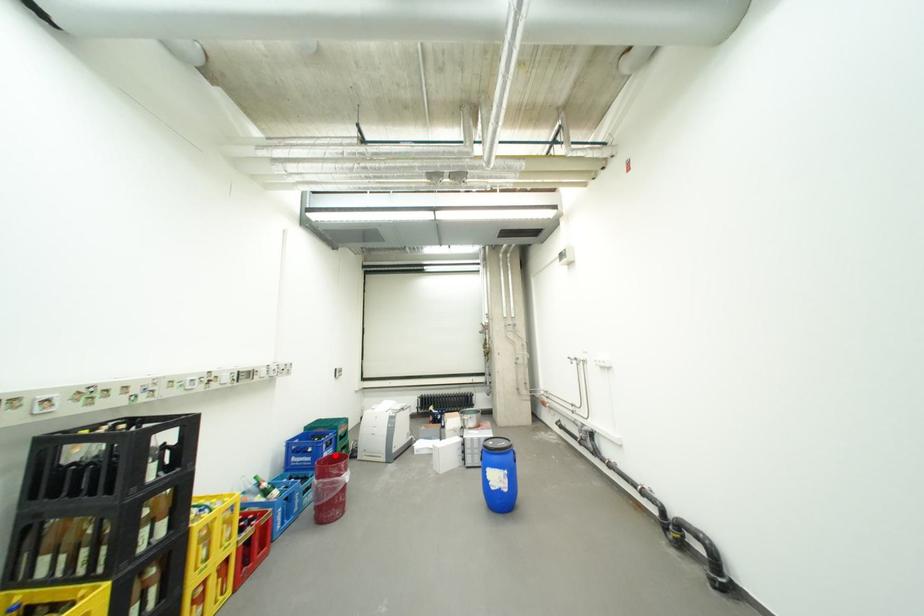
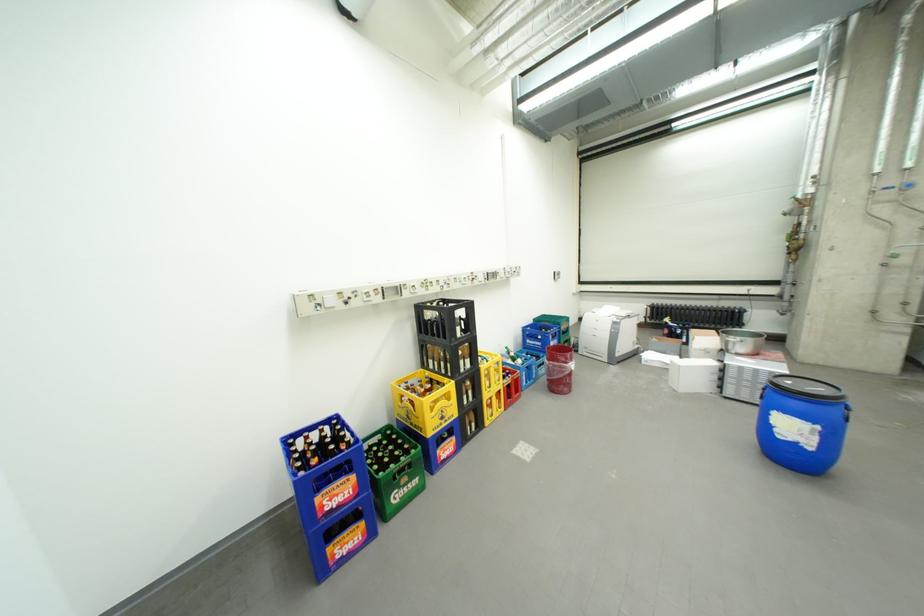
In the second image, find the point that corresponds to the highlighted location in the first image.

(562, 344)